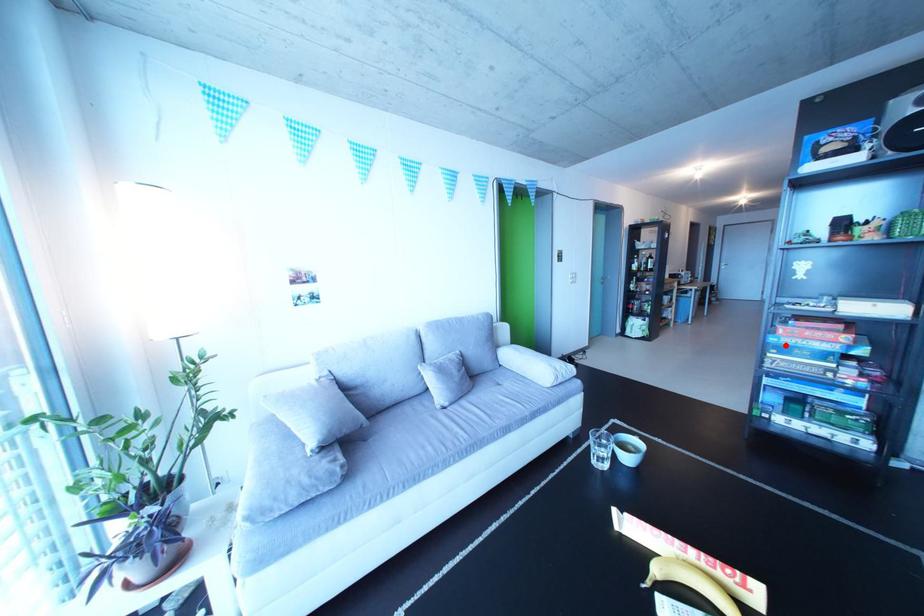
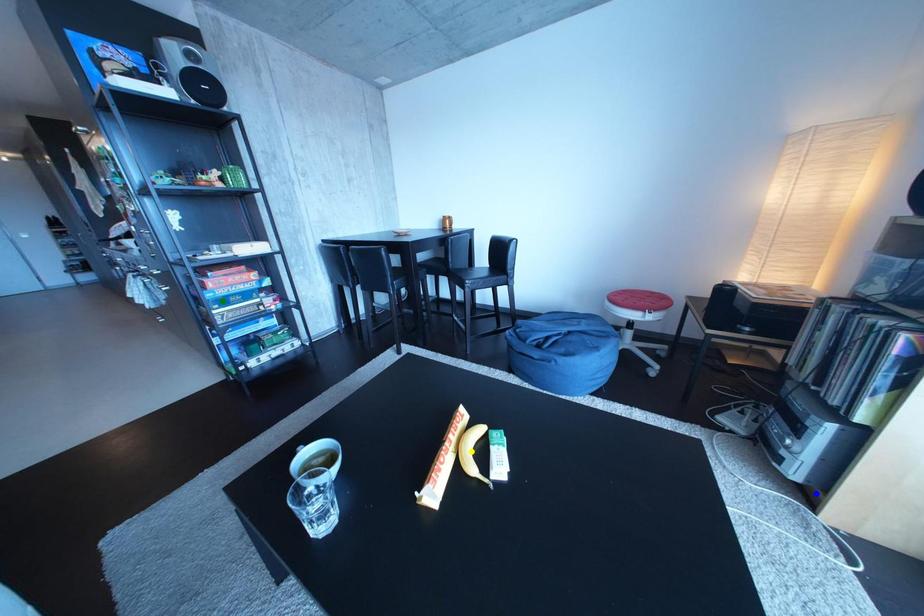
Question: I am providing you with two images of the same scene from different viewpoints. A red point is marked on the first image. You are given multiple points on the second image. Which point in image 2 represents the same 3d spot as the red point in image 1?

Choices:
 (A) yellow point
 (B) blue point
 (C) green point

Answer: (C)